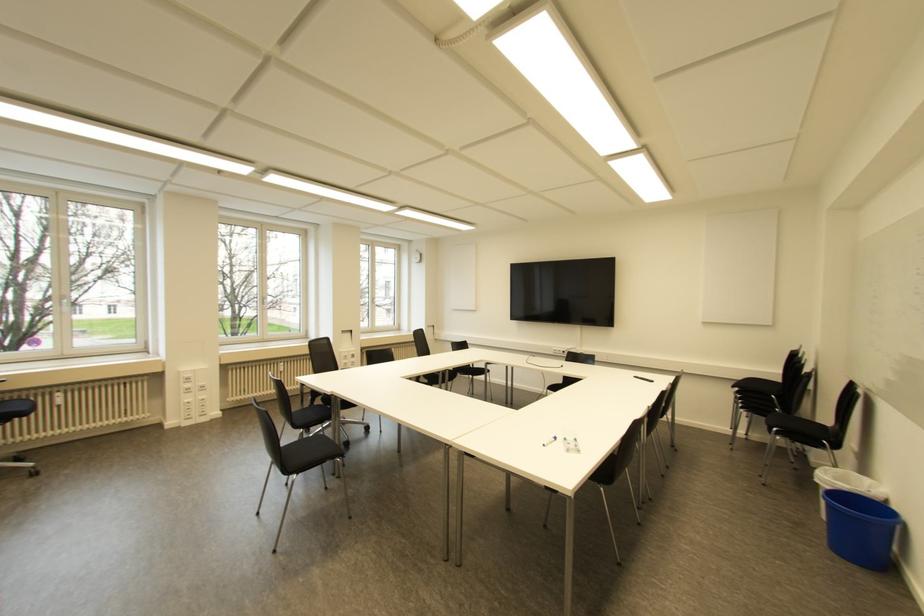
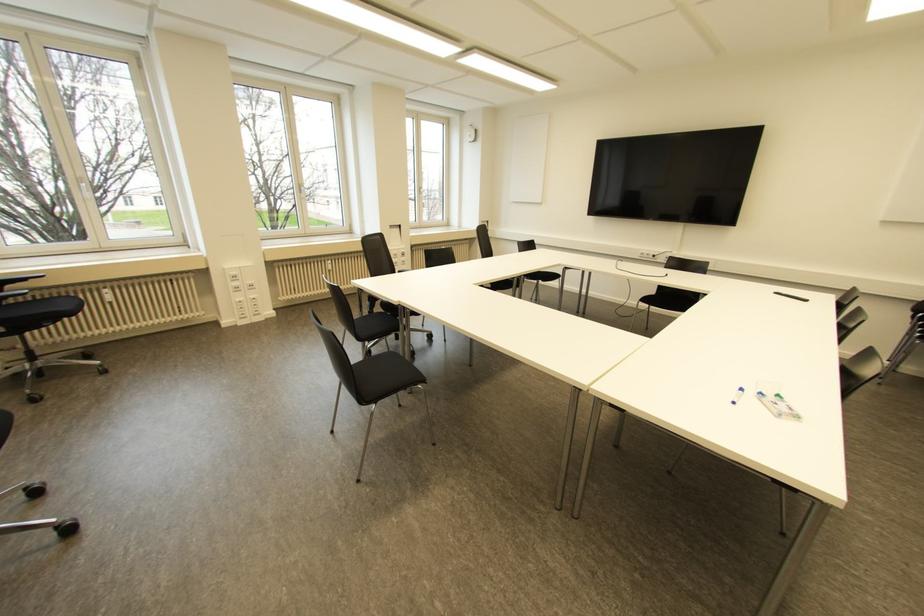
In the second image, find the point that corresponds to pixel 281 368 in the first image.

(330, 267)